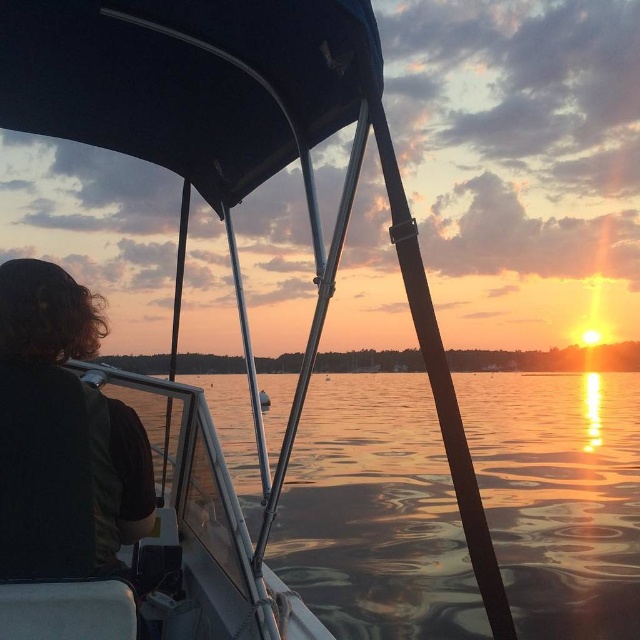
Can you confirm if glistening water at center is positioned to the right of dark brown hair at left?

Indeed, glistening water at center is positioned on the right side of dark brown hair at left.

Looking at this image, does glistening water at center have a larger size compared to dark brown hair at left?

Correct, glistening water at center is larger in size than dark brown hair at left.

Which is behind, point (339, 400) or point (4, 515)?

Point (339, 400)

What are the coordinates of `glistening water at center` in the screenshot? It's located at (374, 515).